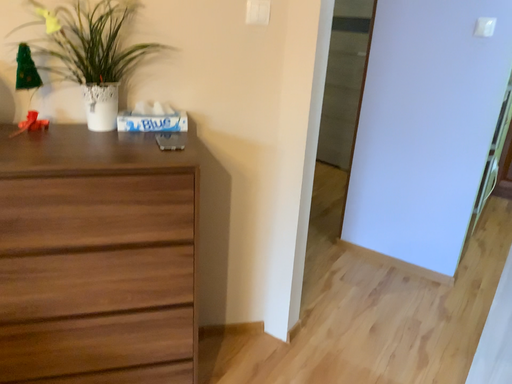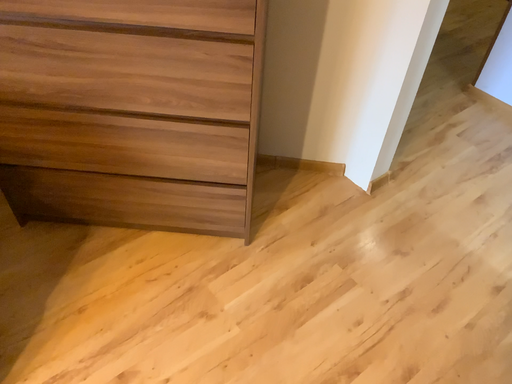
Question: How did the camera likely rotate when shooting the video?

Choices:
 (A) rotated upward
 (B) rotated downward

Answer: (B)